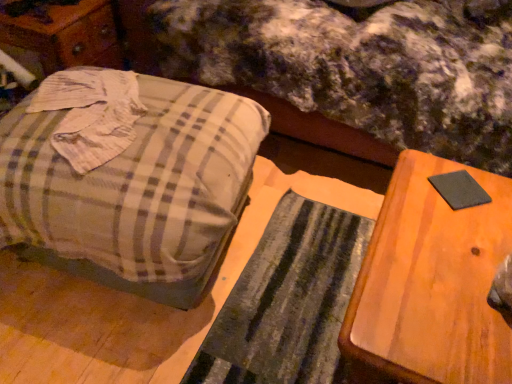
Question: Looking at their shapes, would you say black felt pad at right is wider or thinner than plaid fabric mattress at center?

Choices:
 (A) thin
 (B) wide

Answer: (A)

Question: Would you say black felt pad at right is inside or outside plaid fabric mattress at center?

Choices:
 (A) inside
 (B) outside

Answer: (B)

Question: Estimate the real-world distances between objects in this image. Which object is farther from the plaid fabric mattress at center?

Choices:
 (A) wooden dresser at left
 (B) wooden table at right
 (C) black felt pad at right
 (D) plaid fabric suitcase at left

Answer: (C)

Question: Estimate the real-world distances between objects in this image. Which object is closer to the wooden table at right?

Choices:
 (A) wooden dresser at left
 (B) plaid fabric mattress at center
 (C) black felt pad at right
 (D) plaid fabric suitcase at left

Answer: (C)